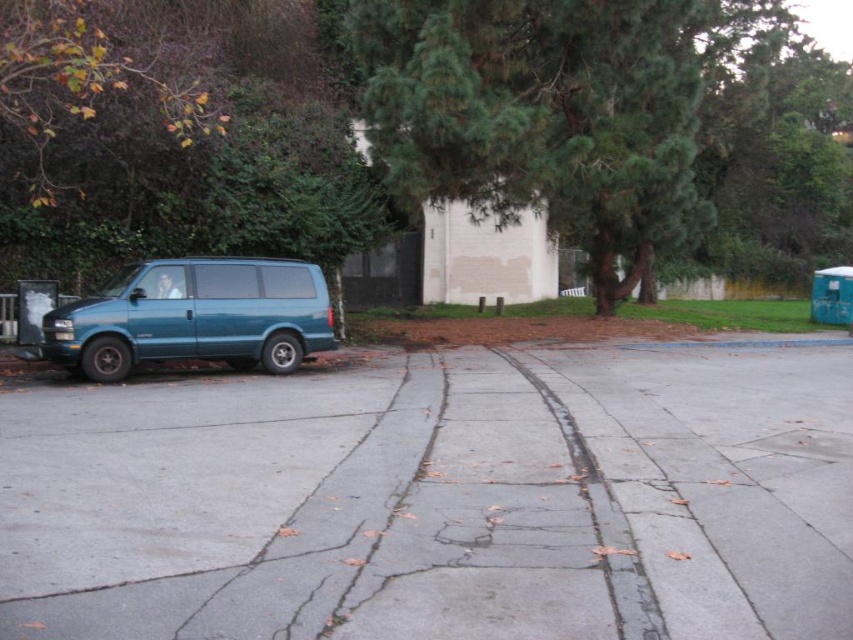
You are standing at the point marked as point (427,131) in the image. What object is located exactly at your current position?

The green leafy tree at upper center is located exactly at point (427,131).

You are a delivery driver who needs to park your teal matte van at left in a spot that won t block the green leafy tree at upper center. Based on the scene, can you park the van without blocking the tree?

The green leafy tree at upper center is positioned over the teal matte van at left, so parking the van there would block the tree. Choose another parking spot to avoid obstruction.

From the picture: You are a delivery person trying to park your van between the gray concrete pavement at center and the green leafy tree at upper center. Can you fit your van between them based on their widths?

The gray concrete pavement at center is narrower than the green leafy tree at upper center, so the van may not fit between them if the pavement is too narrow. However, the exact feasibility depends on the van dimensions and available space not specified here.